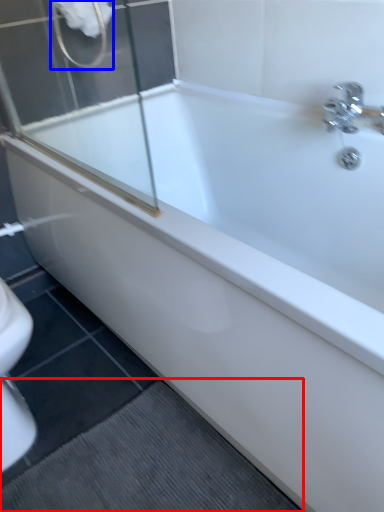
Question: Which point is further to the camera, bath mat (highlighted by a red box) or shower (highlighted by a blue box)?

Choices:
 (A) bath mat
 (B) shower

Answer: (B)